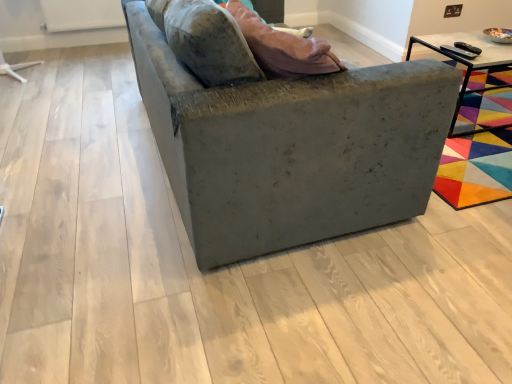
This screenshot has height=384, width=512. In order to click on vacant space positioned to the left of velvet gray couch at center in this screenshot , I will do `click(86, 159)`.